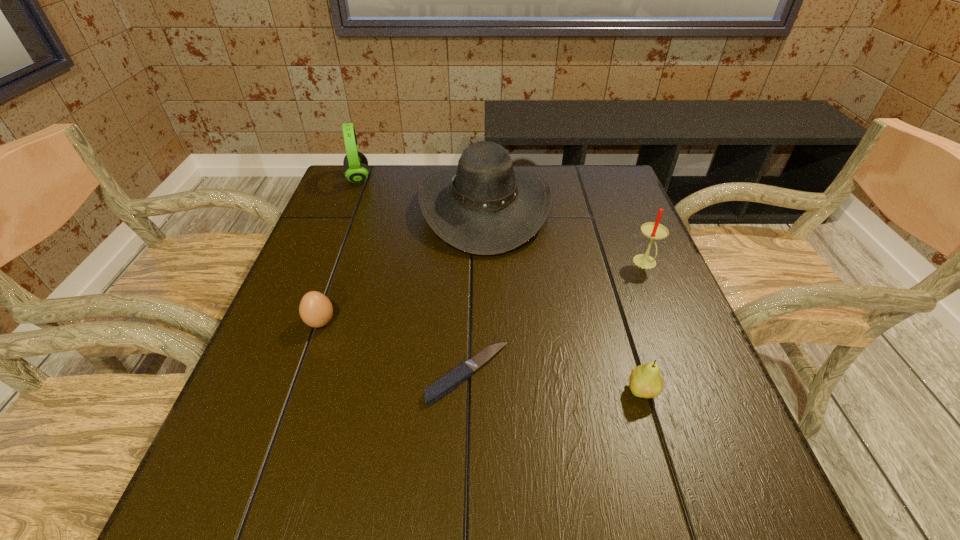
Locate an element on the screen. object present at the far left corner is located at coordinates (356, 170).

You are a GUI agent. You are given a task and a screenshot of the screen. Output one action in this format:
    pyautogui.click(x=<x>, y=<y>)
    Task: Click on the free location at the far edge of the desktop
    The height and width of the screenshot is (540, 960).
    Given the screenshot: What is the action you would take?
    pyautogui.click(x=544, y=174)

You are a GUI agent. You are given a task and a screenshot of the screen. Output one action in this format:
    pyautogui.click(x=<x>, y=<y>)
    Task: Click on the vacant area at the near edge
    Image resolution: width=960 pixels, height=540 pixels.
    Given the screenshot: What is the action you would take?
    pyautogui.click(x=605, y=475)

Image resolution: width=960 pixels, height=540 pixels. I want to click on free location at the left edge of the desktop, so click(x=341, y=225).

The image size is (960, 540). Find the location of `vacant point at the right edge`. vacant point at the right edge is located at coordinates (653, 256).

Where is `blank space at the far left corner of the desktop`? This screenshot has width=960, height=540. blank space at the far left corner of the desktop is located at coordinates (363, 191).

The height and width of the screenshot is (540, 960). In order to click on vacant space that is in between the cowboy hat and the shortest object in this screenshot , I will do `click(477, 291)`.

In order to click on empty location between the boiled egg and the shortest object in this screenshot , I will do point(395,348).

You are a GUI agent. You are given a task and a screenshot of the screen. Output one action in this format:
    pyautogui.click(x=<x>, y=<y>)
    Task: Click on the free space between the shortest object and the third nearest object
    
    Given the screenshot: What is the action you would take?
    pyautogui.click(x=395, y=348)

Locate an element on the screen. blank region between the third nearest object and the headset is located at coordinates (340, 250).